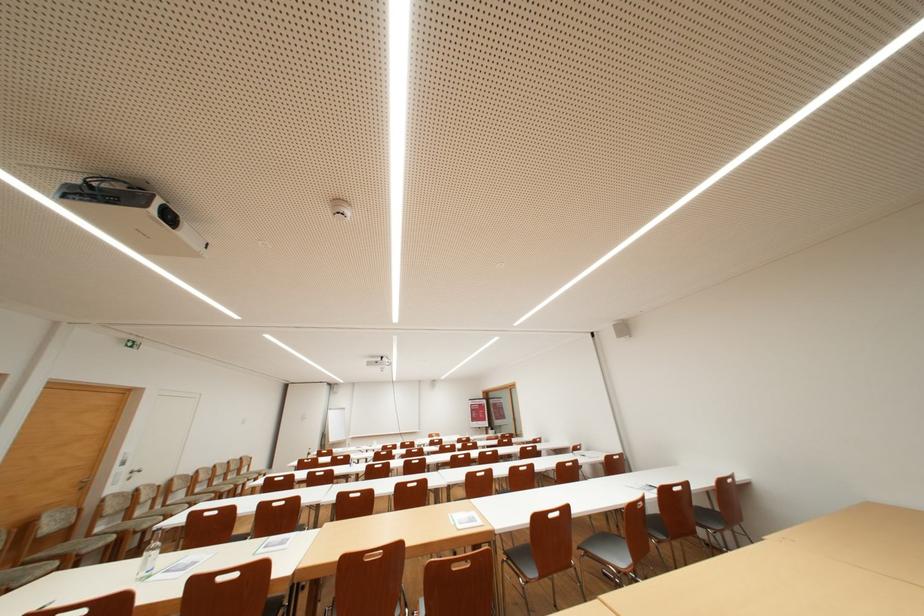
Where would you turn the silver door handle? Please return your answer as a coordinate pair (x, y).

(132, 472)